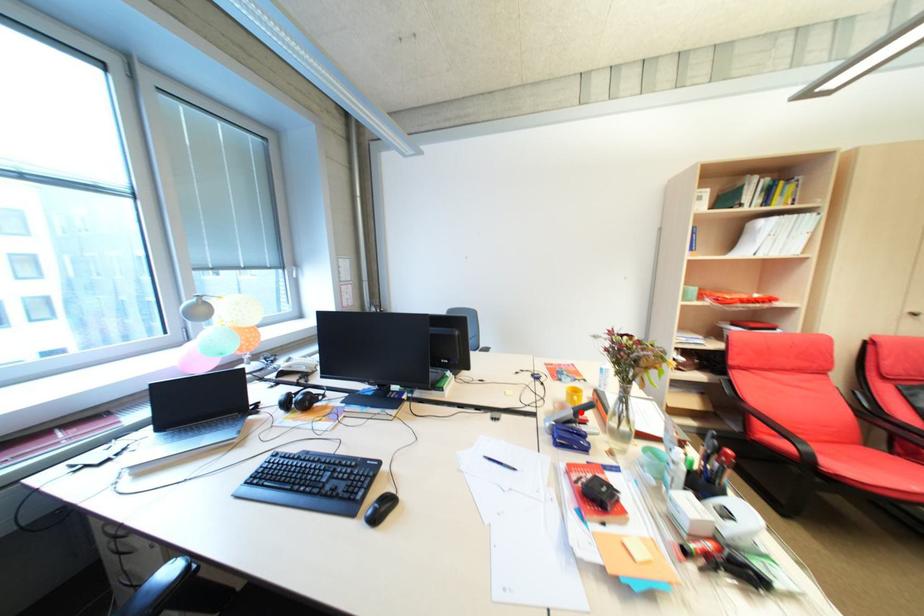
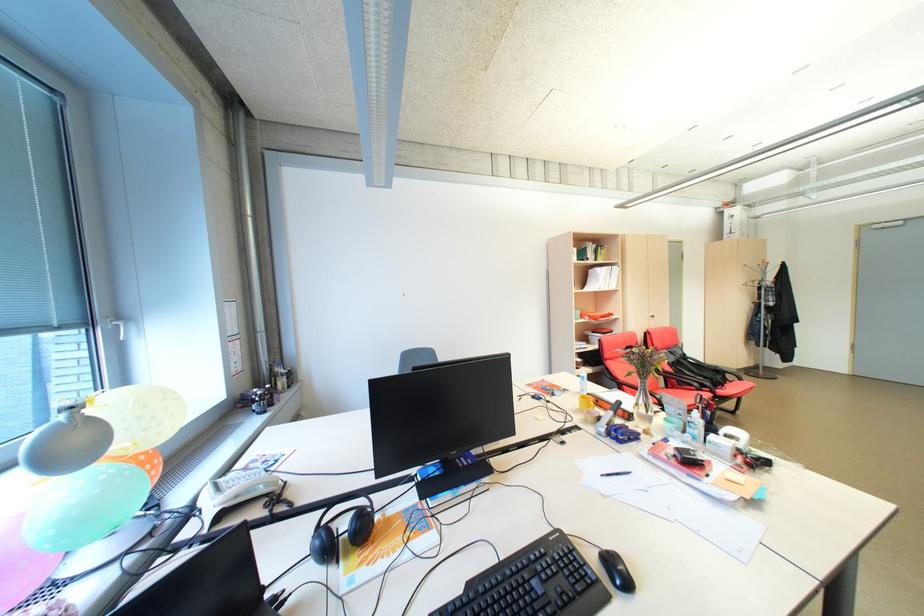
Where in the second image is the point corresponding to the highlighted location from the first image?

(621, 413)